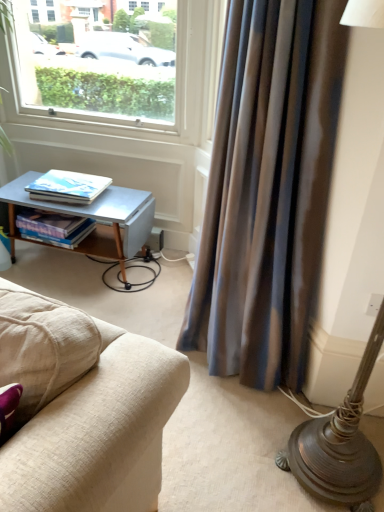
Where is `free space in front of silky blue curtain at right`? The width and height of the screenshot is (384, 512). free space in front of silky blue curtain at right is located at coordinates (229, 444).